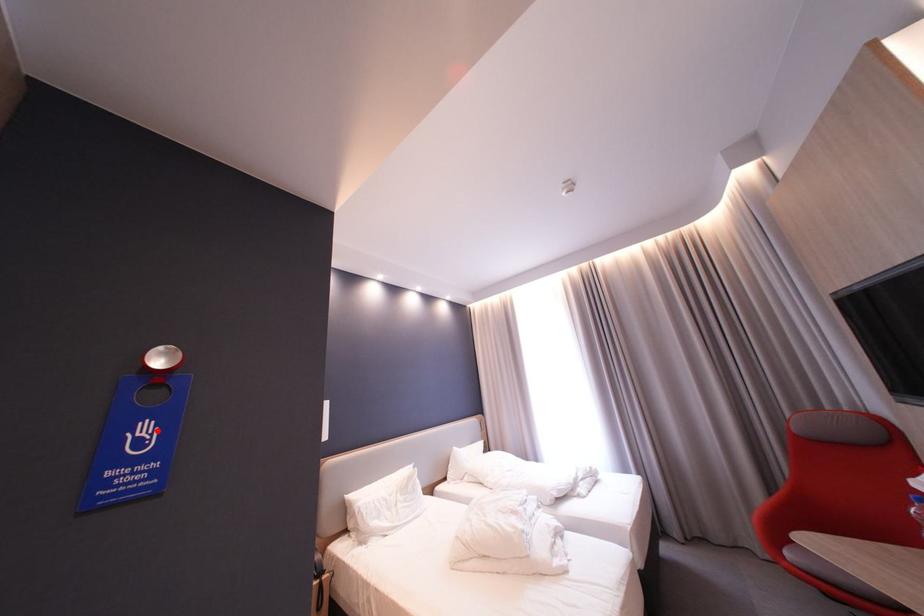
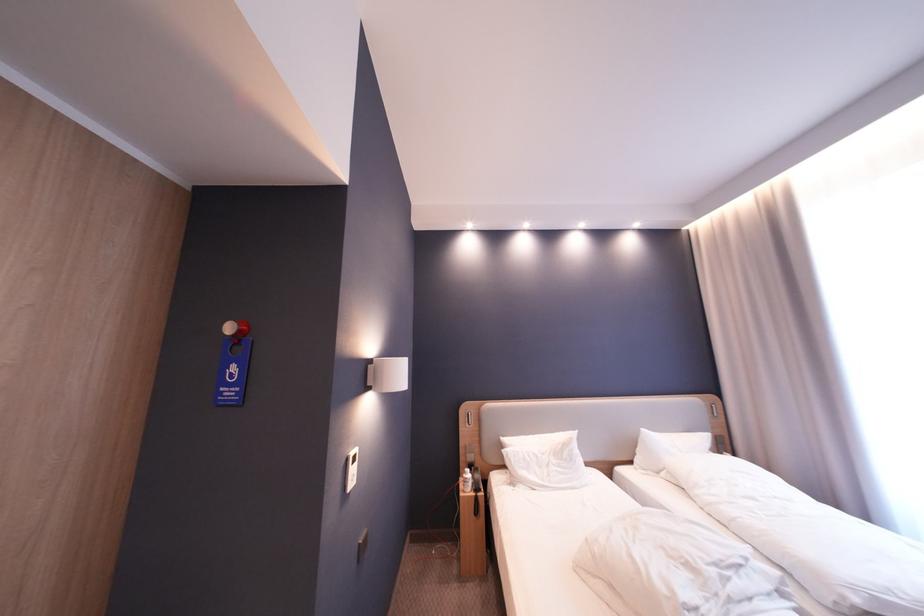
In the second image, find the point that corresponds to the highlighted location in the first image.

(245, 370)